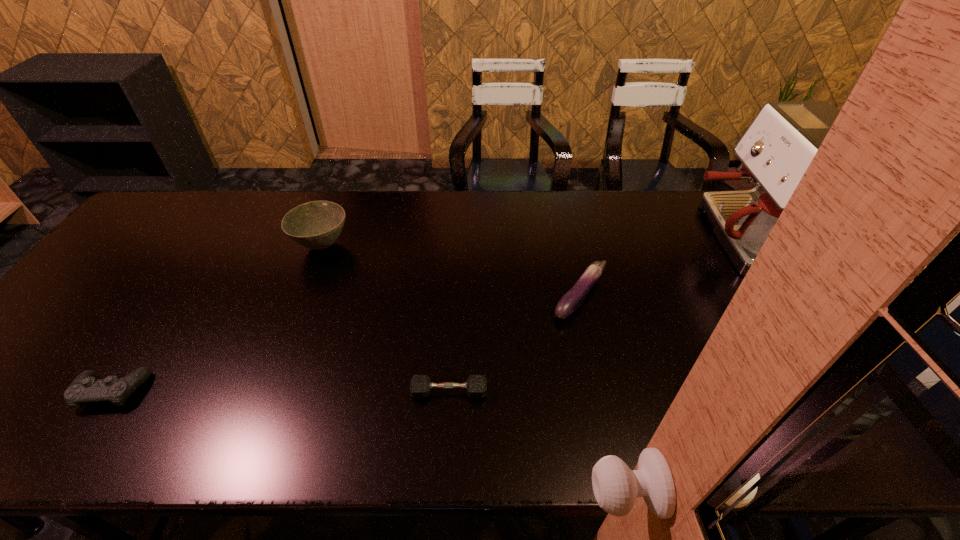
Find the location of a particular element. coffee maker is located at coordinates (778, 146).

You are a GUI agent. You are given a task and a screenshot of the screen. Output one action in this format:
    pyautogui.click(x=<x>, y=<y>)
    Task: Click on the tallest object
    The height and width of the screenshot is (540, 960).
    Given the screenshot: What is the action you would take?
    pyautogui.click(x=778, y=146)

Where is `the second object from left to right`? The width and height of the screenshot is (960, 540). the second object from left to right is located at coordinates pyautogui.click(x=316, y=225).

I want to click on the fourth shortest object, so click(316, 225).

This screenshot has height=540, width=960. I want to click on the fourth object from left to right, so click(x=572, y=299).

In order to click on control in this screenshot , I will do `click(85, 388)`.

The height and width of the screenshot is (540, 960). What are the coordinates of `the third object from right to left` in the screenshot? It's located at (420, 385).

The image size is (960, 540). In order to click on the shortest object in this screenshot , I will do `click(420, 385)`.

At what (x,y) coordinates should I click in order to perform the action: click on free space located 0.400m on the front of the tallest object near the spout. Please return your answer as a coordinate pair (x, y). The width and height of the screenshot is (960, 540). Looking at the image, I should click on (564, 236).

This screenshot has height=540, width=960. I want to click on vacant space situated 0.280m on the front of the tallest object near the spout, so click(602, 236).